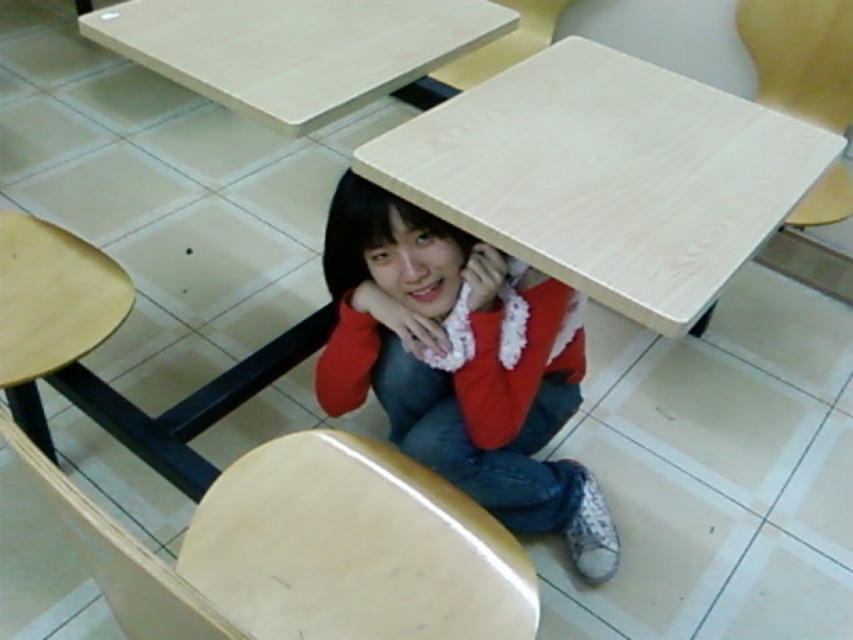
Question: Which is nearer to the light wood/wooden chair at lower left?

Choices:
 (A) red fleece sweater at lower center
 (B) light wood/wooden table at upper center
 (C) wooden chair at upper right

Answer: (A)

Question: Is the position of red fleece sweater at lower center less distant than that of light wood/wooden chair at lower left?

Choices:
 (A) no
 (B) yes

Answer: (A)

Question: Which point is farther from the camera taking this photo?

Choices:
 (A) (531, 384)
 (B) (758, 70)
 (C) (492, 196)

Answer: (B)

Question: Does wooden chair at upper right have a smaller size compared to light wood/wooden chair at lower left?

Choices:
 (A) no
 (B) yes

Answer: (A)

Question: Which object appears closest to the camera in this image?

Choices:
 (A) light wood/wooden table at upper center
 (B) wooden chair at upper right
 (C) light wood/wooden chair at lower left

Answer: (C)

Question: Is light wood/wooden table at upper center further to camera compared to light wood/wooden chair at lower left?

Choices:
 (A) no
 (B) yes

Answer: (B)